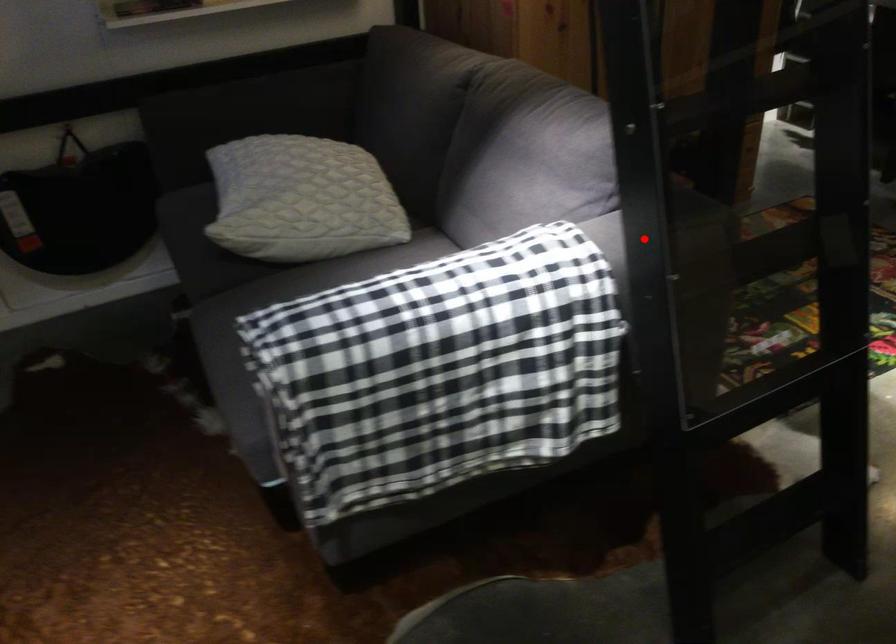
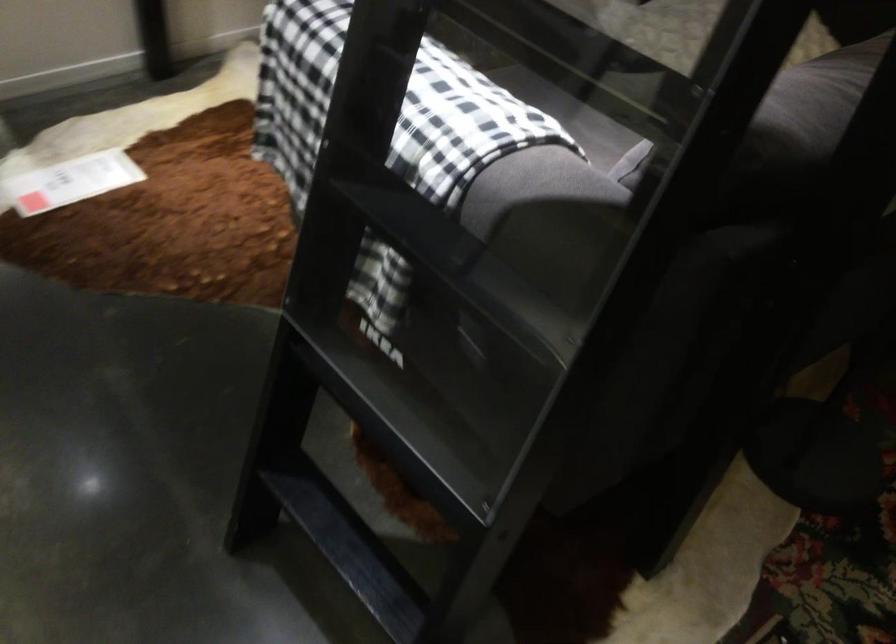
Question: I am providing you with two images of the same scene from different viewpoints. Given a red point in image1, look at the same physical point in image2. Is it:

Choices:
 (A) Closer to the viewpoint
 (B) Farther from the viewpoint

Answer: (A)